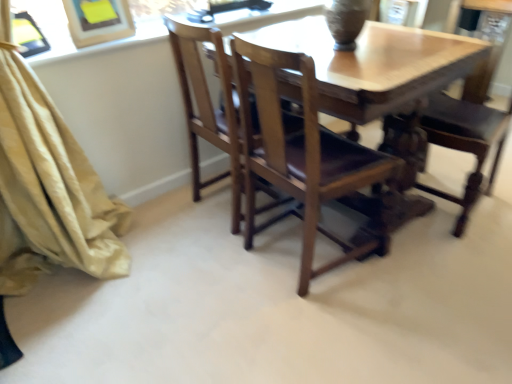
Question: Considering the positions of point (438, 134) and point (353, 16), is point (438, 134) closer or farther from the camera than point (353, 16)?

Choices:
 (A) closer
 (B) farther

Answer: (B)

Question: Considering their positions, is wooden chair at center, the 1th chair from the right, located in front of or behind matte brown vase at upper center?

Choices:
 (A) front
 (B) behind

Answer: (A)

Question: Which object is positioned farthest from the beige fabric curtain at left?

Choices:
 (A) wooden chair at center, which is the second chair in left-to-right order
 (B) matte brown vase at upper center
 (C) wooden chair at center, the 1th chair from the left

Answer: (A)

Question: Estimate the real-world distances between objects in this image. Which object is closer to the matte brown vase at upper center?

Choices:
 (A) beige fabric curtain at left
 (B) wooden chair at center, which is the second chair in left-to-right order
 (C) wooden chair at center, the 1th chair from the left

Answer: (C)